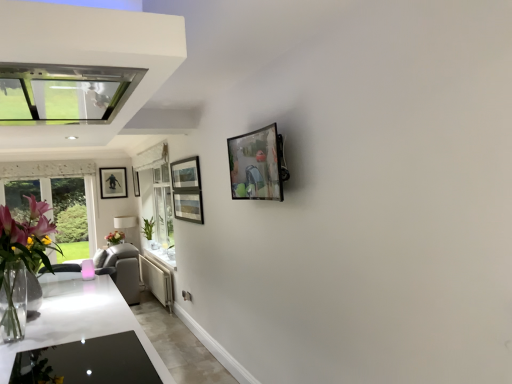
Question: Does clear glass vase at left have a greater width compared to white glossy exhaust hood at upper left?

Choices:
 (A) yes
 (B) no

Answer: (B)

Question: Is clear glass vase at left positioned before white glossy exhaust hood at upper left?

Choices:
 (A) no
 (B) yes

Answer: (A)

Question: Would you say clear glass vase at left is outside white glossy exhaust hood at upper left?

Choices:
 (A) yes
 (B) no

Answer: (A)

Question: Is clear glass vase at left turned away from white glossy exhaust hood at upper left?

Choices:
 (A) yes
 (B) no

Answer: (B)

Question: Is clear glass vase at left next to white glossy exhaust hood at upper left?

Choices:
 (A) yes
 (B) no

Answer: (B)

Question: From a real-world perspective, is clear glass vase at left positioned over white glossy exhaust hood at upper left based on gravity?

Choices:
 (A) no
 (B) yes

Answer: (A)

Question: Is matte white lampshade at center closer to camera compared to metallic glass picture frame at upper center, the third picture frame in the left-to-right sequence?

Choices:
 (A) yes
 (B) no

Answer: (B)

Question: Considering the relative positions of matte white lampshade at center and metallic glass picture frame at upper center, arranged as the 1th picture frame when viewed from the right, in the image provided, is matte white lampshade at center to the right of metallic glass picture frame at upper center, arranged as the 1th picture frame when viewed from the right, from the viewer's perspective?

Choices:
 (A) no
 (B) yes

Answer: (A)

Question: Is there a large distance between matte white lampshade at center and metallic glass picture frame at upper center, which is the 3th picture frame in back-to-front order?

Choices:
 (A) yes
 (B) no

Answer: (A)

Question: Is matte white lampshade at center looking in the opposite direction of metallic glass picture frame at upper center, the third picture frame in the left-to-right sequence?

Choices:
 (A) no
 (B) yes

Answer: (A)

Question: Considering the relative sizes of matte white lampshade at center and metallic glass picture frame at upper center, which is the first picture frame from front to back, in the image provided, is matte white lampshade at center shorter than metallic glass picture frame at upper center, which is the first picture frame from front to back,?

Choices:
 (A) yes
 (B) no

Answer: (B)

Question: Does matte white lampshade at center have a greater width compared to metallic glass picture frame at upper center, which is the first picture frame from front to back?

Choices:
 (A) no
 (B) yes

Answer: (B)

Question: Can you see matte white lampshade at center touching green leafy plant at lower left?

Choices:
 (A) yes
 (B) no

Answer: (B)